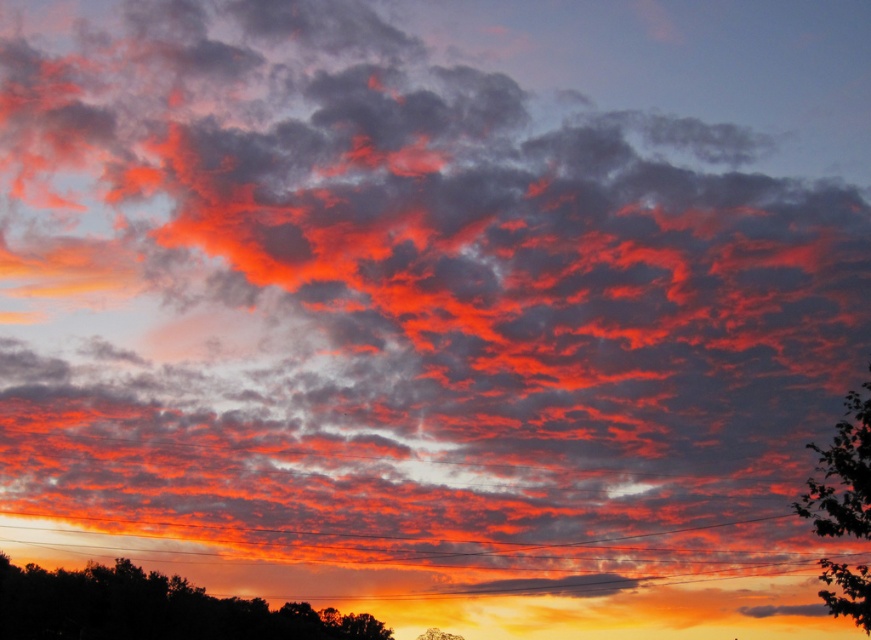
In order to click on dark green leafy tree at lower left in this screenshot , I will do `click(153, 609)`.

Can you confirm if dark green leafy tree at lower left is wider than green leafy tree at lower center?

Indeed, dark green leafy tree at lower left has a greater width compared to green leafy tree at lower center.

Based on the photo, who is more forward, (18,630) or (439,632)?

Point (439,632) is more forward.

Find the location of a particular element. The width and height of the screenshot is (871, 640). dark green leafy tree at lower left is located at coordinates (153, 609).

Between green leafy tree at right and green leafy tree at lower center, which one has more height?

green leafy tree at lower center is taller.

How much distance is there between green leafy tree at right and green leafy tree at lower center?

160.97 feet

Locate an element on the screen. green leafy tree at right is located at coordinates (842, 474).

Does dark green leafy tree at lower left have a larger size compared to green leafy tree at right?

Yes, dark green leafy tree at lower left is bigger than green leafy tree at right.

Which is below, dark green leafy tree at lower left or green leafy tree at right?

dark green leafy tree at lower left is lower down.

Is point (242, 625) positioned after point (839, 484)?

Yes, it is.

Where is `dark green leafy tree at lower left`? The height and width of the screenshot is (640, 871). dark green leafy tree at lower left is located at coordinates (153, 609).